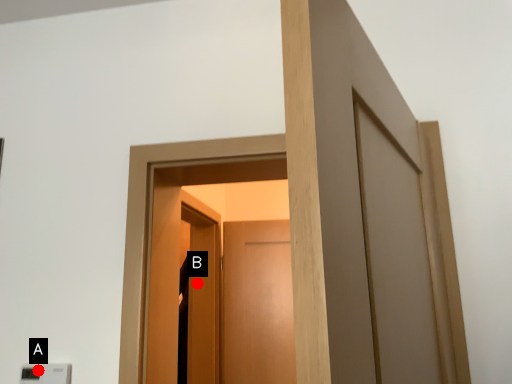
Question: Two points are circled on the image, labeled by A and B beside each circle. Among these points, which one is nearest to the camera?

Choices:
 (A) A is closer
 (B) B is closer

Answer: (A)